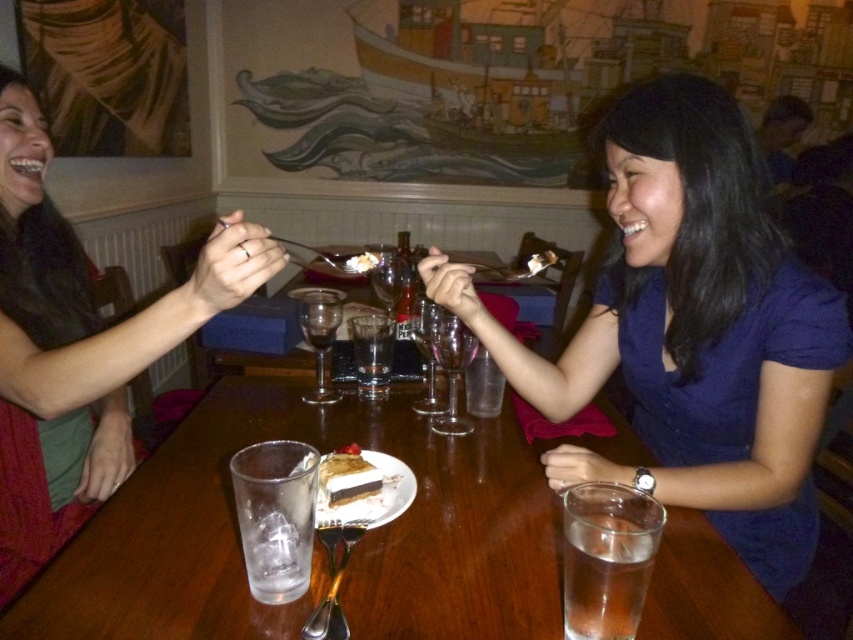
You are a waiter in a restaurant. You need to place a new dessert menu on the table between the chocolate cake at center and the transparent glass at center. Which side of the table should you choose to ensure the menu fits without overlapping either item?

The chocolate cake at center is wider than the transparent glass at center. To place the dessert menu between them without overlapping, you should position it on the side of the transparent glass at center since it has more space available due to its narrower width.

You are sitting at the table in the image and want to reach the item located at point [16,522]. Is this item closer to you than the item at point [310,337]?

Yes, the item at point [16,522] is closer to you because it is in front of the item at point [310,337].